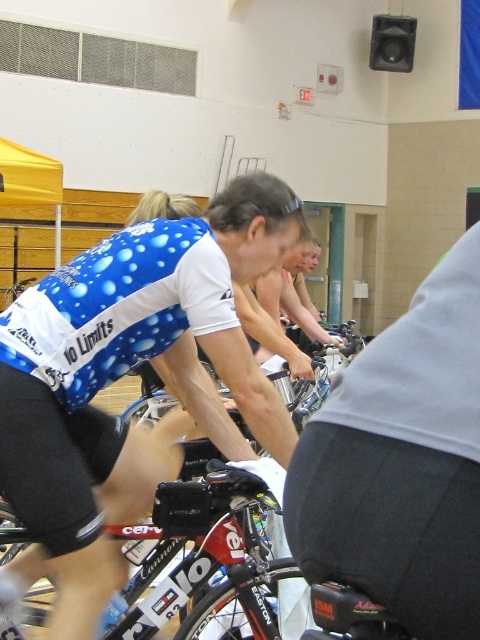
Who is taller, blue/white jersey at center or matte blue cycling jersey at center?

blue/white jersey at center

Can you confirm if blue/white jersey at center is shorter than matte blue cycling jersey at center?

In fact, blue/white jersey at center may be taller than matte blue cycling jersey at center.

Is point (291, 451) in front of point (317, 448)?

That is False.

You are a GUI agent. You are given a task and a screenshot of the screen. Output one action in this format:
    pyautogui.click(x=<x>, y=<y>)
    Task: Click on the blue/white jersey at center
    The height and width of the screenshot is (640, 480).
    Given the screenshot: What is the action you would take?
    pyautogui.click(x=122, y=374)

Between blue/white jersey at center and shiny red bicycle at center, which one appears on the left side from the viewer's perspective?

From the viewer's perspective, blue/white jersey at center appears more on the left side.

Between blue/white jersey at center and shiny red bicycle at center, which one has less height?

shiny red bicycle at center is shorter.

Is point (240, 276) positioned behind point (210, 509)?

Yes, point (240, 276) is farther from viewer.

Identify the location of blue/white jersey at center. The height and width of the screenshot is (640, 480). (122, 374).

Is point (408, 413) more distant than point (247, 496)?

No, (408, 413) is closer to viewer.

Can you confirm if matte blue cycling jersey at center is positioned above shiny red bicycle at center?

Indeed, matte blue cycling jersey at center is positioned over shiny red bicycle at center.

Which is in front, point (467, 413) or point (196, 516)?

Point (467, 413) is more forward.

Locate an element on the screen. This screenshot has height=640, width=480. matte blue cycling jersey at center is located at coordinates (402, 461).